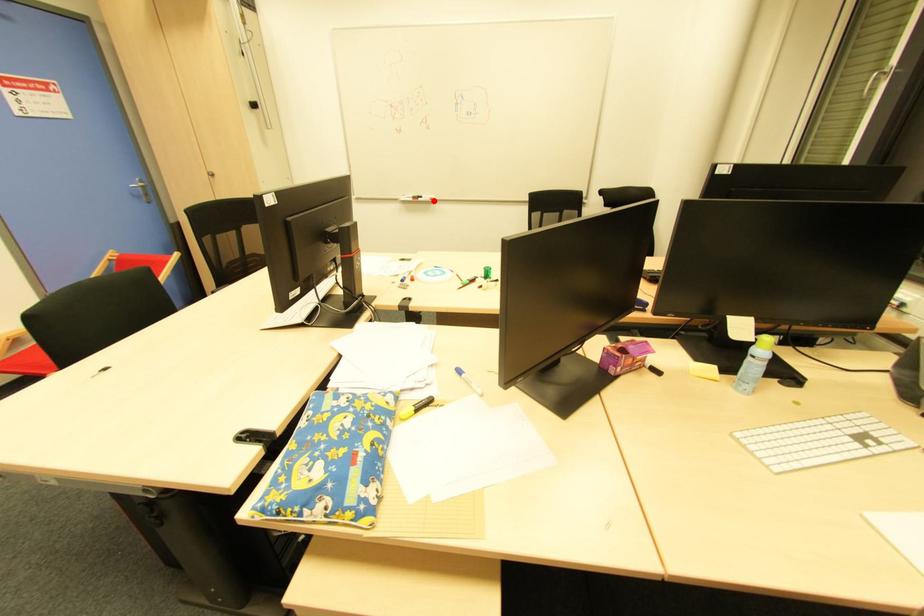
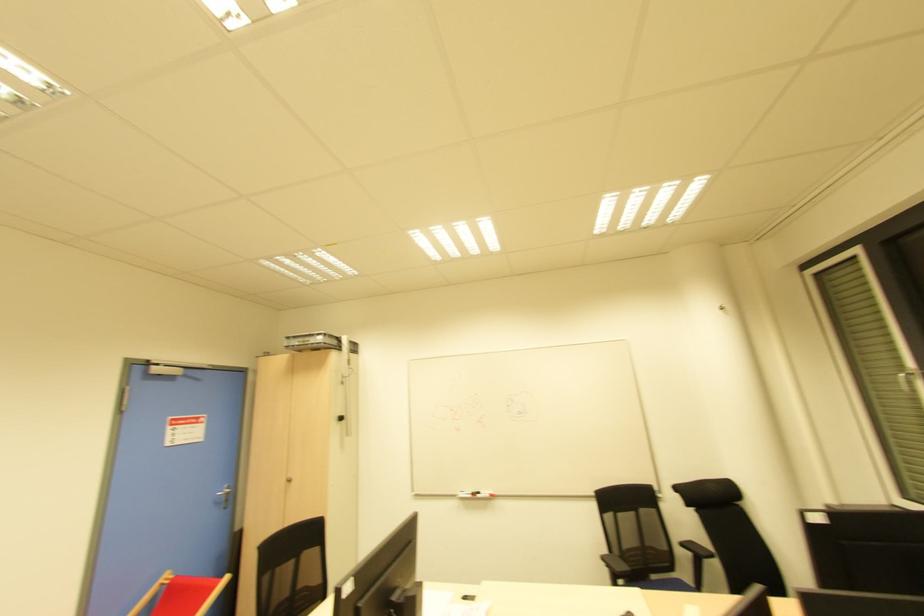
Locate, in the second image, the point that corresponds to the highlighted location in the first image.

(492, 496)